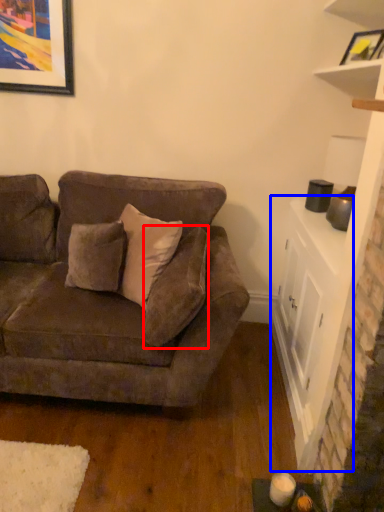
Question: Among these objects, which one is nearest to the camera, pillow (highlighted by a red box) or table (highlighted by a blue box)?

Choices:
 (A) pillow
 (B) table

Answer: (A)